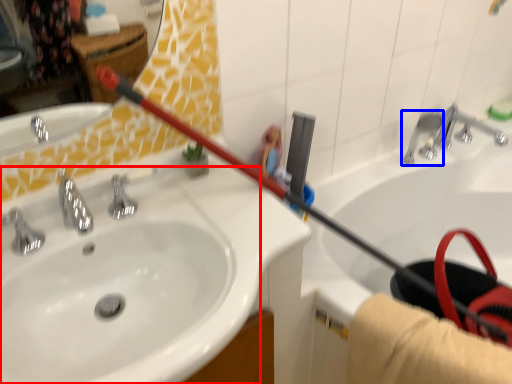
Question: Which object appears farthest to the camera in this image, sink (highlighted by a red box) or plumbing fixture (highlighted by a blue box)?

Choices:
 (A) sink
 (B) plumbing fixture

Answer: (B)